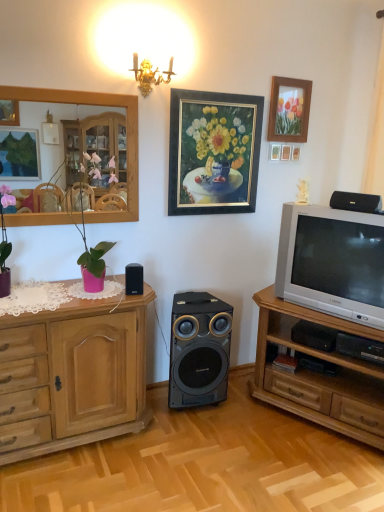
Question: Is wooden mirror at upper left thinner than black plastic speaker at upper right, marked as the 3th loudspeaker in a back-to-front arrangement?

Choices:
 (A) yes
 (B) no

Answer: (A)

Question: From a real-world perspective, is wooden mirror at upper left under black plastic speaker at upper right, which ranks as the third loudspeaker in bottom-to-top order?

Choices:
 (A) no
 (B) yes

Answer: (A)

Question: Is black plastic speaker at upper right, which ranks as the 3th loudspeaker in left-to-right order, located within wooden mirror at upper left?

Choices:
 (A) no
 (B) yes

Answer: (A)

Question: Does wooden mirror at upper left lie in front of black plastic speaker at upper right, which is the first loudspeaker from front to back?

Choices:
 (A) yes
 (B) no

Answer: (A)

Question: Does wooden mirror at upper left appear on the right side of black plastic speaker at upper right, acting as the first loudspeaker starting from the right?

Choices:
 (A) no
 (B) yes

Answer: (A)

Question: From the image's perspective, is wooden mirror at upper left beneath black plastic speaker at upper right, marked as the 3th loudspeaker in a back-to-front arrangement?

Choices:
 (A) no
 (B) yes

Answer: (A)

Question: Is black plastic speaker at center, which ranks as the first loudspeaker in left-to-right order, not close to black plastic speaker at upper right, which ranks as the third loudspeaker in bottom-to-top order?

Choices:
 (A) yes
 (B) no

Answer: (A)

Question: From a real-world perspective, is black plastic speaker at center, arranged as the third loudspeaker when viewed from the right, positioned over black plastic speaker at upper right, which is the first loudspeaker from front to back, based on gravity?

Choices:
 (A) yes
 (B) no

Answer: (B)

Question: Considering the relative sizes of black plastic speaker at center, the 2th loudspeaker in the front-to-back sequence, and black plastic speaker at upper right, which ranks as the third loudspeaker in bottom-to-top order, in the image provided, is black plastic speaker at center, the 2th loudspeaker in the front-to-back sequence, smaller than black plastic speaker at upper right, which ranks as the third loudspeaker in bottom-to-top order,?

Choices:
 (A) yes
 (B) no

Answer: (A)

Question: Can you confirm if black plastic speaker at center, placed as the second loudspeaker when sorted from back to front, is wider than black plastic speaker at upper right, which ranks as the third loudspeaker in bottom-to-top order?

Choices:
 (A) no
 (B) yes

Answer: (B)

Question: Does black plastic speaker at center, which is counted as the second loudspeaker, starting from the bottom, come behind black plastic speaker at upper right, which ranks as the third loudspeaker in bottom-to-top order?

Choices:
 (A) yes
 (B) no

Answer: (A)

Question: Is black plastic speaker at center, the 2th loudspeaker in the front-to-back sequence, facing towards black plastic speaker at upper right, which ranks as the 3th loudspeaker in left-to-right order?

Choices:
 (A) no
 (B) yes

Answer: (A)

Question: From the image's perspective, would you say wooden cabinet at left is positioned over silver metallic television at right?

Choices:
 (A) no
 (B) yes

Answer: (A)